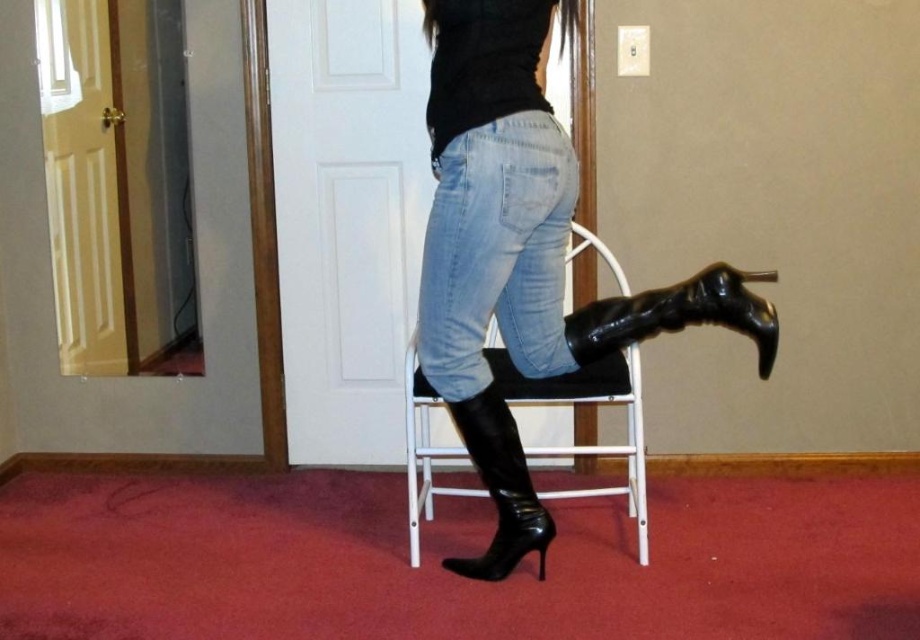
You are trying to reach the light switch on the wall behind the shiny black boots at center and the black leather bar stool at center. Can you reach it without moving either of them?

The shiny black boots at center is in front of the black leather bar stool at center, so you can reach the light switch behind them by moving around the shiny black boots at center.

You are trying to place the shiny black boots at center and the black leather bar stool at center in a narrow hallway. Which object will require more space horizontally?

The shiny black boots at center has a larger width than the black leather bar stool at center, so it will require more horizontal space.

You are trying to clean the floor in the room. You see the shiny black boots at center and the black leather bar stool at center. Which object should you move first to access the floor underneath?

The shiny black boots at center is positioned over the black leather bar stool at center, so you should move the shiny black boots at center first to access the floor underneath.